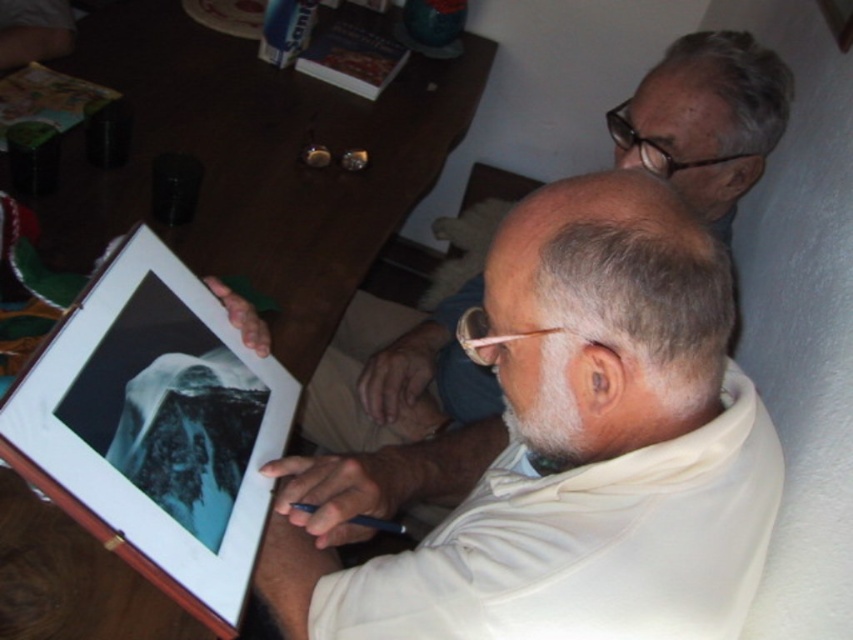
Question: Among these objects, which one is nearest to the camera?

Choices:
 (A) white matte shirt at upper right
 (B) white matte shirt at center

Answer: (B)

Question: Is white matte shirt at center above white matte shirt at upper right?

Choices:
 (A) yes
 (B) no

Answer: (B)

Question: Which object is farther from the camera taking this photo?

Choices:
 (A) white matte shirt at upper right
 (B) white matte shirt at center

Answer: (A)

Question: Is white matte shirt at center positioned behind white matte shirt at upper right?

Choices:
 (A) no
 (B) yes

Answer: (A)

Question: Is white matte shirt at center positioned behind white matte shirt at upper right?

Choices:
 (A) no
 (B) yes

Answer: (A)

Question: Which object appears closest to the camera in this image?

Choices:
 (A) white matte shirt at center
 (B) white matte shirt at upper right

Answer: (A)